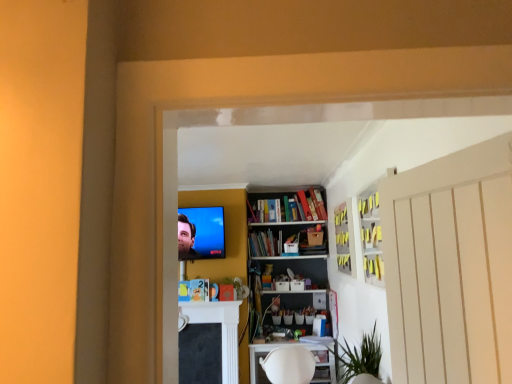
Measure the distance between yellow matte cabinet at upper center, acting as the 1th cabinet starting from the back, and camera.

The depth of yellow matte cabinet at upper center, acting as the 1th cabinet starting from the back, is 3.20 meters.

Where is `matte black tv at upper center`? The image size is (512, 384). matte black tv at upper center is located at coordinates (201, 233).

Find the location of `white glossy cabinet at upper right, the first cabinet in the front-to-back sequence`. white glossy cabinet at upper right, the first cabinet in the front-to-back sequence is located at coordinates (371, 235).

What do you see at coordinates (296, 345) in the screenshot?
I see `white plastic table at lower center` at bounding box center [296, 345].

Image resolution: width=512 pixels, height=384 pixels. What are the coordinates of `matte yellow book at center, placed as the second book when sorted from right to left` in the screenshot? It's located at (193, 290).

Does point (209, 237) appear closer or farther from the camera than point (254, 360)?

Clearly, point (209, 237) is more distant from the camera than point (254, 360).

From a real-world perspective, who is located higher, matte black tv at upper center or white plastic table at lower center?

In real-world perspective, matte black tv at upper center is above.

Can you confirm if matte black tv at upper center is smaller than white plastic table at lower center?

Correct, matte black tv at upper center occupies less space than white plastic table at lower center.

Relative to hardcover book at center, arranged as the 2th book when viewed from the left, is green matte plant at center in front or behind?

Visually, green matte plant at center is located in front of hardcover book at center, arranged as the 2th book when viewed from the left.

Based on the photo, which of these two, green matte plant at center or hardcover book at center, acting as the 1th book starting from the back, is smaller?

green matte plant at center is smaller.

Between green matte plant at center and hardcover book at center, arranged as the second book when ordered from the bottom, which one appears on the left side from the viewer's perspective?

green matte plant at center.

Looking at their sizes, would you say green matte plant at center is wider or thinner than hardcover book at center, arranged as the 2th book when viewed from the left?

Clearly, green matte plant at center has less width compared to hardcover book at center, arranged as the 2th book when viewed from the left.

From the picture: How many degrees apart are the facing directions of yellow matte cabinet at upper center, acting as the 1th cabinet starting from the back, and matte yellow book at center, placed as the second book when sorted from right to left?

There is a 90-degree angle between the facing directions of yellow matte cabinet at upper center, acting as the 1th cabinet starting from the back, and matte yellow book at center, placed as the second book when sorted from right to left.

From the picture: Is yellow matte cabinet at upper center, the second cabinet from the front, in front of or behind matte yellow book at center, the second book in the top-to-bottom sequence, in the image?

Visually, yellow matte cabinet at upper center, the second cabinet from the front, is located in front of matte yellow book at center, the second book in the top-to-bottom sequence.

Which object is thinner, yellow matte cabinet at upper center, the second cabinet from the front, or matte yellow book at center, marked as the 1th book in a left-to-right arrangement?

yellow matte cabinet at upper center, the second cabinet from the front, is thinner.

Are yellow matte cabinet at upper center, the second cabinet from the front, and matte yellow book at center, which ranks as the 2th book in back-to-front order, making contact?

No, yellow matte cabinet at upper center, the second cabinet from the front, is not making contact with matte yellow book at center, which ranks as the 2th book in back-to-front order.

Which of these two, white glossy cabinet at upper right, the first cabinet in the front-to-back sequence, or white plastic table at lower center, stands shorter?

white plastic table at lower center.

Relative to white plastic table at lower center, is white glossy cabinet at upper right, the first cabinet in the front-to-back sequence, in front or behind?

white glossy cabinet at upper right, the first cabinet in the front-to-back sequence, is positioned closer to the viewer than white plastic table at lower center.

Is matte yellow book at center, the 1th book from the bottom, far away from hardcover book at center, marked as the 1th book in a top-to-bottom arrangement?

Actually, matte yellow book at center, the 1th book from the bottom, and hardcover book at center, marked as the 1th book in a top-to-bottom arrangement, are a little close together.

Is matte yellow book at center, the 1th book from the bottom, taller than hardcover book at center, arranged as the 2th book when viewed from the left?

In fact, matte yellow book at center, the 1th book from the bottom, may be shorter than hardcover book at center, arranged as the 2th book when viewed from the left.

Is matte yellow book at center, marked as the 1th book in a left-to-right arrangement, further to camera compared to hardcover book at center, marked as the 1th book in a top-to-bottom arrangement?

No, it is in front of hardcover book at center, marked as the 1th book in a top-to-bottom arrangement.

Would you say hardcover book at center, marked as the 1th book in a top-to-bottom arrangement, is part of matte yellow book at center, the second book in the top-to-bottom sequence,'s contents?

No, hardcover book at center, marked as the 1th book in a top-to-bottom arrangement, is located outside of matte yellow book at center, the second book in the top-to-bottom sequence.

Considering the relative positions of hardcover book at center, marked as the 1th book in a top-to-bottom arrangement, and green matte plant at center in the image provided, is hardcover book at center, marked as the 1th book in a top-to-bottom arrangement, behind green matte plant at center?

Yes, it is behind green matte plant at center.

From a real-world perspective, relative to green matte plant at center, is hardcover book at center, which ranks as the first book in right-to-left order, vertically above or below?

Clearly, from a real-world perspective, hardcover book at center, which ranks as the first book in right-to-left order, is above green matte plant at center.

Considering the relative sizes of hardcover book at center, arranged as the second book when ordered from the bottom, and green matte plant at center in the image provided, is hardcover book at center, arranged as the second book when ordered from the bottom, bigger than green matte plant at center?

Yes.

Based on the photo, is hardcover book at center, marked as the 1th book in a top-to-bottom arrangement, outside of green matte plant at center?

hardcover book at center, marked as the 1th book in a top-to-bottom arrangement, lies outside green matte plant at center's area.

Is matte yellow book at center, placed as the second book when sorted from right to left, in contact with white plastic table at lower center?

There is a gap between matte yellow book at center, placed as the second book when sorted from right to left, and white plastic table at lower center.

From the image's perspective, is matte yellow book at center, the second book in the top-to-bottom sequence, located above or below white plastic table at lower center?

From the image's perspective, matte yellow book at center, the second book in the top-to-bottom sequence, appears above white plastic table at lower center.

Does matte yellow book at center, marked as the 1th book in a left-to-right arrangement, have a lesser height compared to white plastic table at lower center?

Yes.

Which object is closer to the camera taking this photo, matte yellow book at center, marked as the 1th book in a left-to-right arrangement, or white plastic table at lower center?

white plastic table at lower center is more forward.

There is a white plastic table at lower center. Identify the location of television above it (from a real-world perspective). (201, 233).

Identify the location of plant beneath the hardcover book at center, acting as the 1th book starting from the back (from a real-world perspective). This screenshot has height=384, width=512. pyautogui.click(x=234, y=288).

When comparing their distances from hardcover book at center, which is the second book in front-to-back order, does white glossy cabinet at upper right, the first cabinet in the front-to-back sequence, or yellow matte cabinet at upper center, acting as the 1th cabinet starting from the back, seem further?

white glossy cabinet at upper right, the first cabinet in the front-to-back sequence.

Looking at the image, which one is located further to matte yellow book at center, the second book in the top-to-bottom sequence, white plastic table at lower center or yellow matte cabinet at upper center, the second cabinet from the front?

The object further to matte yellow book at center, the second book in the top-to-bottom sequence, is yellow matte cabinet at upper center, the second cabinet from the front.

Estimate the real-world distances between objects in this image. Which object is closer to matte yellow book at center, placed as the second book when sorted from right to left, white glossy cabinet at upper right, which is the 2th cabinet in back-to-front order, or matte black tv at upper center?

Among the two, matte black tv at upper center is located nearer to matte yellow book at center, placed as the second book when sorted from right to left.

Based on their spatial positions, is yellow matte cabinet at upper center, the second cabinet from the front, or white plastic table at lower center closer to hardcover book at center, acting as the 1th book starting from the back?

white plastic table at lower center is closer to hardcover book at center, acting as the 1th book starting from the back.

Based on their spatial positions, is hardcover book at center, arranged as the second book when ordered from the bottom, or green matte plant at center further from matte yellow book at center, which ranks as the 2th book in back-to-front order?

hardcover book at center, arranged as the second book when ordered from the bottom, is positioned further to the anchor matte yellow book at center, which ranks as the 2th book in back-to-front order.

Based on their spatial positions, is hardcover book at center, which is the second book in front-to-back order, or yellow matte cabinet at upper center, the second cabinet from the front, closer to white glossy cabinet at upper right, which is the 2th cabinet in back-to-front order?

yellow matte cabinet at upper center, the second cabinet from the front, is positioned closer to the anchor white glossy cabinet at upper right, which is the 2th cabinet in back-to-front order.

Looking at the image, which one is located closer to white plastic table at lower center, hardcover book at center, which ranks as the first book in right-to-left order, or green matte plant at center?

green matte plant at center.

Looking at the image, which one is located closer to hardcover book at center, arranged as the second book when ordered from the bottom, green matte plant at center or matte black tv at upper center?

green matte plant at center lies closer to hardcover book at center, arranged as the second book when ordered from the bottom, than the other object.

Locate an element on the screen. This screenshot has height=384, width=512. plant between matte yellow book at center, which ranks as the 2th book in back-to-front order, and white plastic table at lower center is located at coordinates (234, 288).

The width and height of the screenshot is (512, 384). I want to click on table positioned between white glossy cabinet at upper right, which is the 2th cabinet in back-to-front order, and matte black tv at upper center from near to far, so click(x=296, y=345).

Identify the location of book between yellow matte cabinet at upper center, the second cabinet from the front, and hardcover book at center, acting as the 1th book starting from the back, along the z-axis. (193, 290).

Image resolution: width=512 pixels, height=384 pixels. What are the coordinates of `cabinet between white glossy cabinet at upper right, which is the 2th cabinet in back-to-front order, and green matte plant at center, along the z-axis` in the screenshot? It's located at (345, 238).